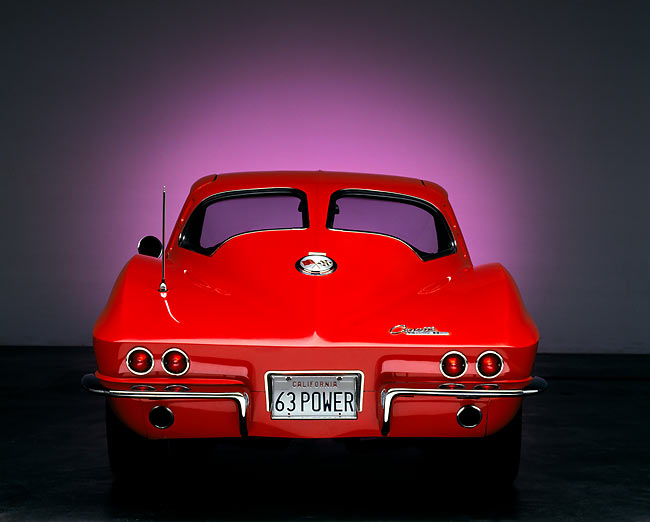
Where is `mirror`? mirror is located at coordinates (151, 246).